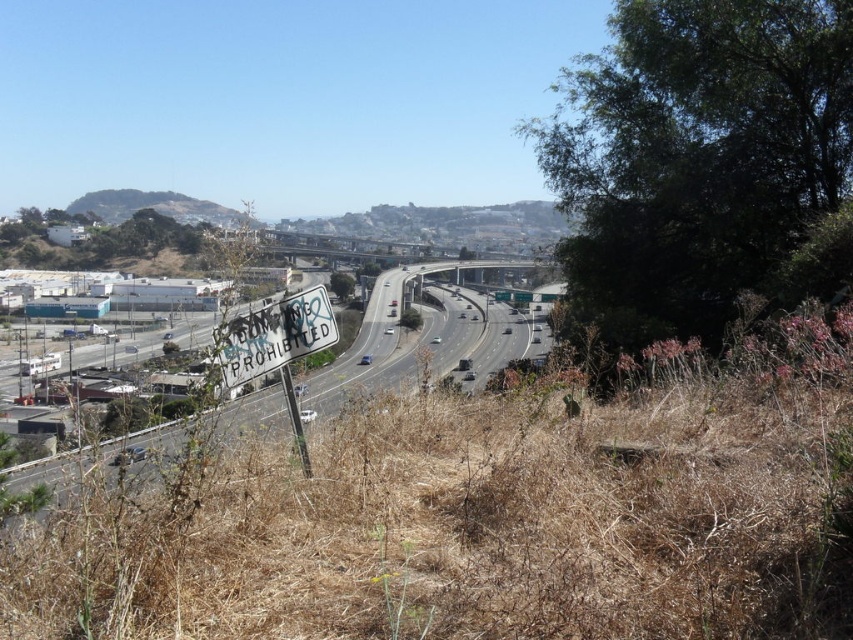
You are a truck driver planning to take a photo of the white sign at center and the green grassy hillside at upper left from your vehicle. If you want to capture both objects in a single frame without zooming, which object should you position closer to the edge of the frame?

The white sign at center should be positioned closer to the edge of the frame because its width is smaller than the green grassy hillside at upper left, allowing it to fit within the frame more easily when placed near the edge.

Consider the image. You are standing at the point labeled as point (x=115, y=198) and want to walk towards the point labeled as point (x=525, y=355). Given the highway scene described, which direction should you move relative to your current position to reach the destination?

Since point (x=525, y=355) is closer to the viewer than point (x=115, y=198), you should move towards the direction that brings you closer to the foreground of the image. In the highway scene, this would mean walking uphill or towards the lower part of the highway where the signpost and dry grass are located.

You are a driver approaching the highway and see the white sign at center and the green grassy hillside at upper left. Which object appears larger in the image?

The white sign at center appears larger because it is much taller than the green grassy hillside at upper left.